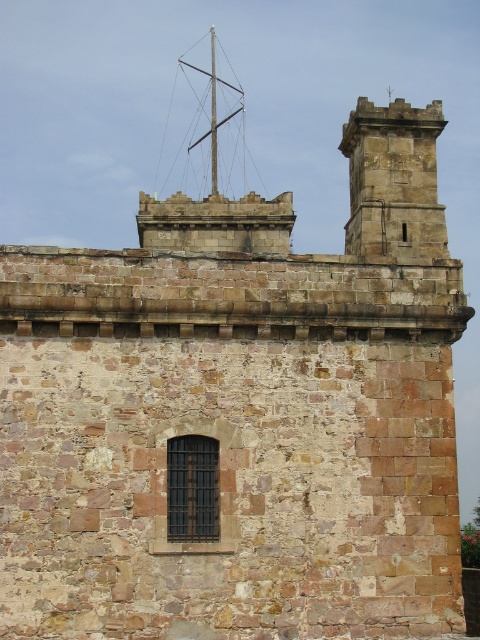
Question: Is stone tower at upper right to the left of metallic silver mast at upper center from the viewer's perspective?

Choices:
 (A) yes
 (B) no

Answer: (B)

Question: Does stone tower at upper right come behind metallic silver mast at upper center?

Choices:
 (A) yes
 (B) no

Answer: (B)

Question: Which point is closer to the camera taking this photo?

Choices:
 (A) (399, 211)
 (B) (212, 131)

Answer: (A)

Question: Which of the following is the farthest from the observer?

Choices:
 (A) stone tower at upper right
 (B) metallic silver mast at upper center

Answer: (B)

Question: Can you confirm if stone tower at upper right is bigger than metallic silver mast at upper center?

Choices:
 (A) no
 (B) yes

Answer: (B)